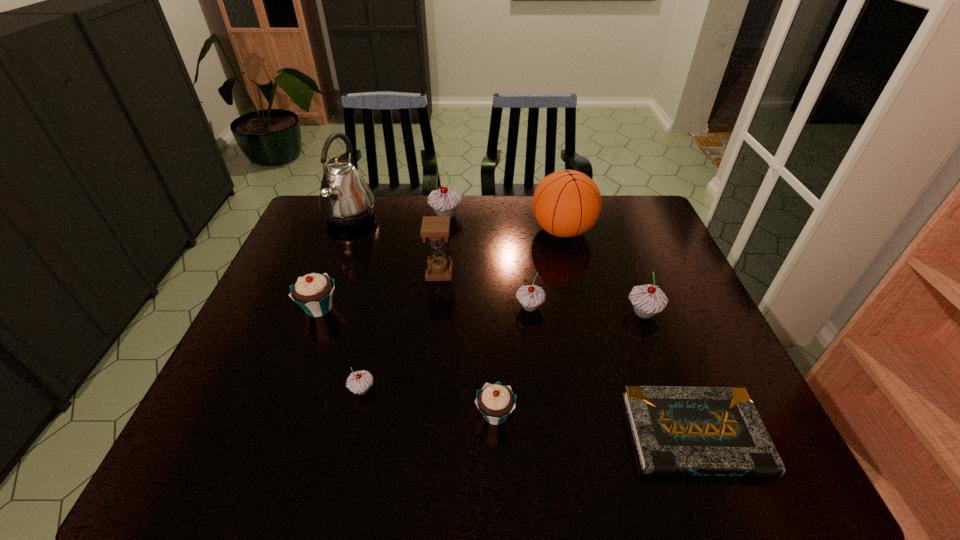
Identify which object is the fourth nearest to the fourth cupcake from right to left. Please provide its 2D coordinates. Your answer should be formatted as a tuple, i.e. [(x, y)], where the tuple contains the x and y coordinates of a point satisfying the conditions above.

[(530, 296)]

The width and height of the screenshot is (960, 540). Find the location of `object that is the seventh closest to the fifth tallest object`. object that is the seventh closest to the fifth tallest object is located at coordinates (358, 382).

Find the location of a particular element. The height and width of the screenshot is (540, 960). cupcake that can be found as the closest to the basketball is located at coordinates (530, 296).

Point out which cupcake is positioned as the fifth nearest to the farthest gray cupcake. Please provide its 2D coordinates. Your answer should be formatted as a tuple, i.e. [(x, y)], where the tuple contains the x and y coordinates of a point satisfying the conditions above.

[(495, 401)]

Point out which gray cupcake is positioned as the second nearest to the basketball. Please provide its 2D coordinates. Your answer should be formatted as a tuple, i.e. [(x, y)], where the tuple contains the x and y coordinates of a point satisfying the conditions above.

[(647, 300)]

Locate an element on the screen. the second closest gray cupcake to the farthest gray cupcake is located at coordinates (647, 300).

You are a GUI agent. You are given a task and a screenshot of the screen. Output one action in this format:
    pyautogui.click(x=<x>, y=<y>)
    Task: Click on the free spot that satisfies the following two spatial constraints: 1. on the front side of the biggest gray cupcake; 2. on the left side of the fifth cupcake from left to right
    This screenshot has width=960, height=540.
    Given the screenshot: What is the action you would take?
    pyautogui.click(x=437, y=307)

This screenshot has width=960, height=540. In order to click on free spot that satisfies the following two spatial constraints: 1. on the front side of the tallest object; 2. on the right side of the fifth cupcake from left to right in this screenshot , I will do `click(314, 307)`.